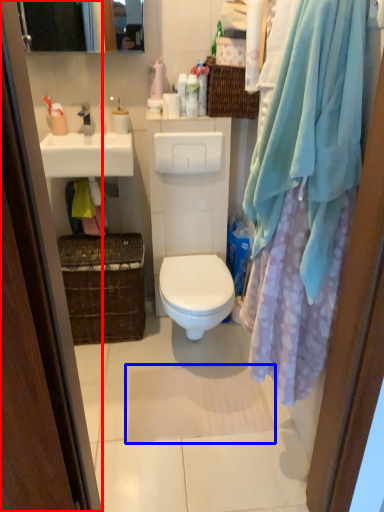
Question: Which point is closer to the camera, screen door (highlighted by a red box) or bath mat (highlighted by a blue box)?

Choices:
 (A) screen door
 (B) bath mat

Answer: (A)